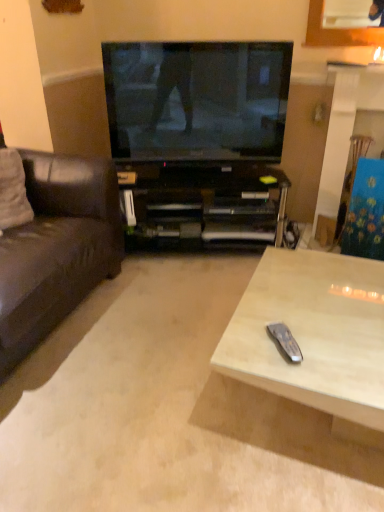
Locate an element on the screen. This screenshot has width=384, height=512. vacant area situated below matte black tv at center (from a real-world perspective) is located at coordinates (182, 179).